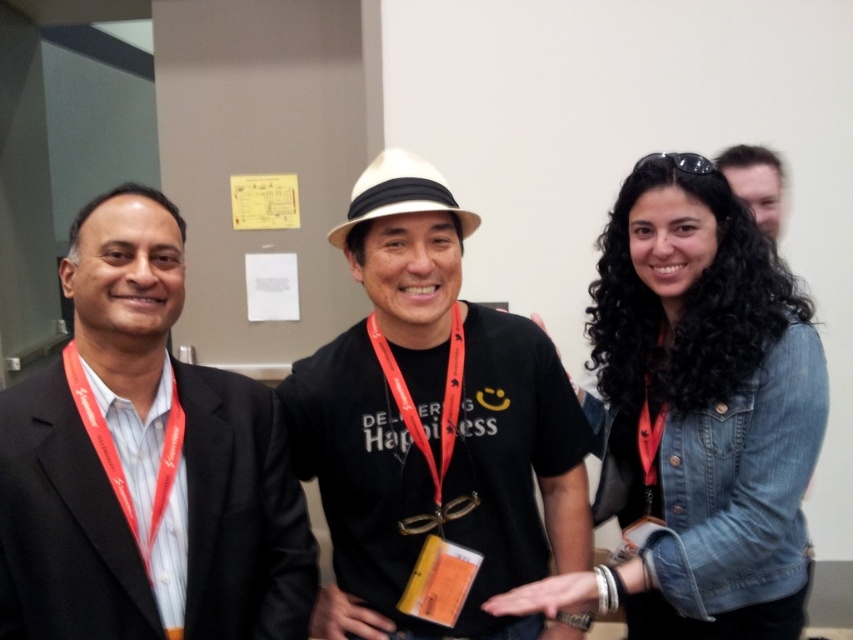
You are standing in front of the group photo and want to touch the two points marked in the image. Which point, point [422,326] or point [416,518], would require you to reach further to touch it?

Point [416,518] is further from the viewer than point [422,326], so you would need to reach further to touch point [416,518].

Looking at this image, you are standing at the point marked by coordinates point [750,221] and want to take a photo of the three people in the scene. The camera you have can focus on subjects within 1.5 meters. Will the camera be able to capture all three individuals clearly?

The distance between point [750,221] and the camera is 1.38 meters, which is within the camera focus range of 1.5 meters. Therefore, the camera can capture all three individuals clearly.